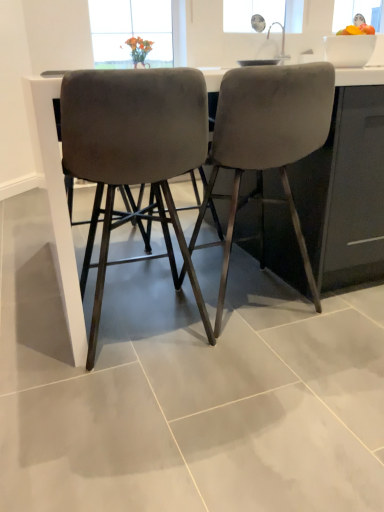
Question: Which direction should I rotate to look at velvet gray chair at center, which is the 2th chair from left to right?

Choices:
 (A) right
 (B) left

Answer: (A)

Question: In which direction should I rotate to look at velvet grey chair at center, the first chair viewed from the left?

Choices:
 (A) left
 (B) right

Answer: (A)

Question: From a real-world perspective, is satin gray barstools at center over velvet gray chair at center, which is the 1th chair in right-to-left order?

Choices:
 (A) yes
 (B) no

Answer: (B)

Question: Considering the relative positions of satin gray barstools at center and velvet gray chair at center, which is the 1th chair in right-to-left order, in the image provided, is satin gray barstools at center in front of velvet gray chair at center, which is the 1th chair in right-to-left order,?

Choices:
 (A) yes
 (B) no

Answer: (A)

Question: Is satin gray barstools at center located outside velvet gray chair at center, which is the 1th chair in right-to-left order?

Choices:
 (A) yes
 (B) no

Answer: (A)

Question: Does satin gray barstools at center have a lesser height compared to velvet gray chair at center, which is the 2th chair from left to right?

Choices:
 (A) no
 (B) yes

Answer: (B)

Question: Is satin gray barstools at center at the right side of velvet gray chair at center, which is the 1th chair in right-to-left order?

Choices:
 (A) no
 (B) yes

Answer: (B)

Question: From a real-world perspective, is satin gray barstools at center located beneath velvet gray chair at center, which is the 2th chair from left to right?

Choices:
 (A) yes
 (B) no

Answer: (A)

Question: Is satin gray barstools at center far from velvet grey chair at center, marked as the 2th chair in a right-to-left arrangement?

Choices:
 (A) no
 (B) yes

Answer: (A)

Question: From the image's perspective, is satin gray barstools at center beneath velvet grey chair at center, marked as the 2th chair in a right-to-left arrangement?

Choices:
 (A) yes
 (B) no

Answer: (B)

Question: From the image's perspective, is satin gray barstools at center over velvet grey chair at center, the first chair viewed from the left?

Choices:
 (A) yes
 (B) no

Answer: (A)

Question: From a real-world perspective, is satin gray barstools at center physically above velvet grey chair at center, marked as the 2th chair in a right-to-left arrangement?

Choices:
 (A) no
 (B) yes

Answer: (A)

Question: Does satin gray barstools at center appear on the right side of velvet grey chair at center, the first chair viewed from the left?

Choices:
 (A) yes
 (B) no

Answer: (A)

Question: Is satin gray barstools at center turned away from velvet grey chair at center, the first chair viewed from the left?

Choices:
 (A) no
 (B) yes

Answer: (A)

Question: Is velvet grey chair at center, marked as the 2th chair in a right-to-left arrangement, positioned behind velvet gray chair at center, which is the 1th chair in right-to-left order?

Choices:
 (A) yes
 (B) no

Answer: (B)